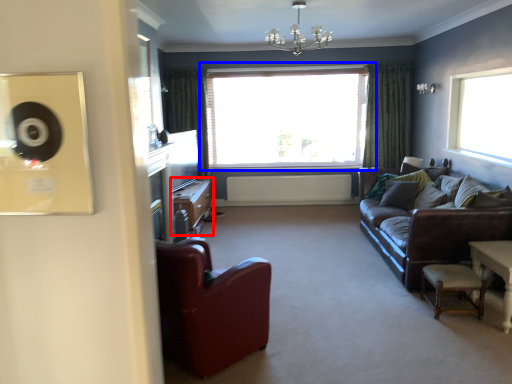
Question: Which point is further to the camera, cabinetry (highlighted by a red box) or window (highlighted by a blue box)?

Choices:
 (A) cabinetry
 (B) window

Answer: (B)